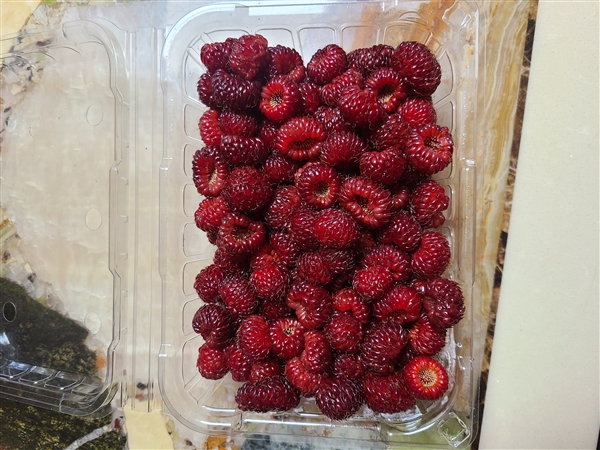
I want to click on marble design, so click(493, 124).